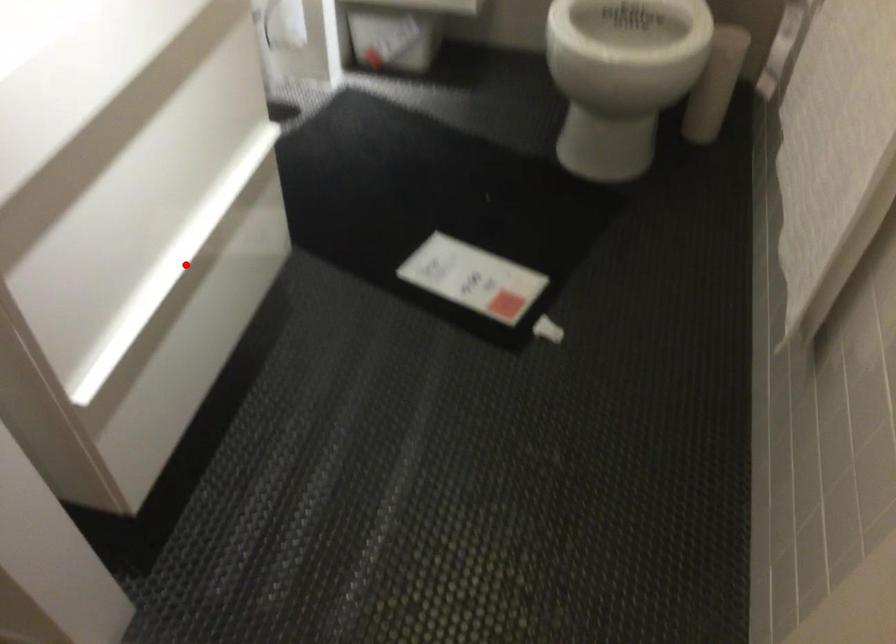
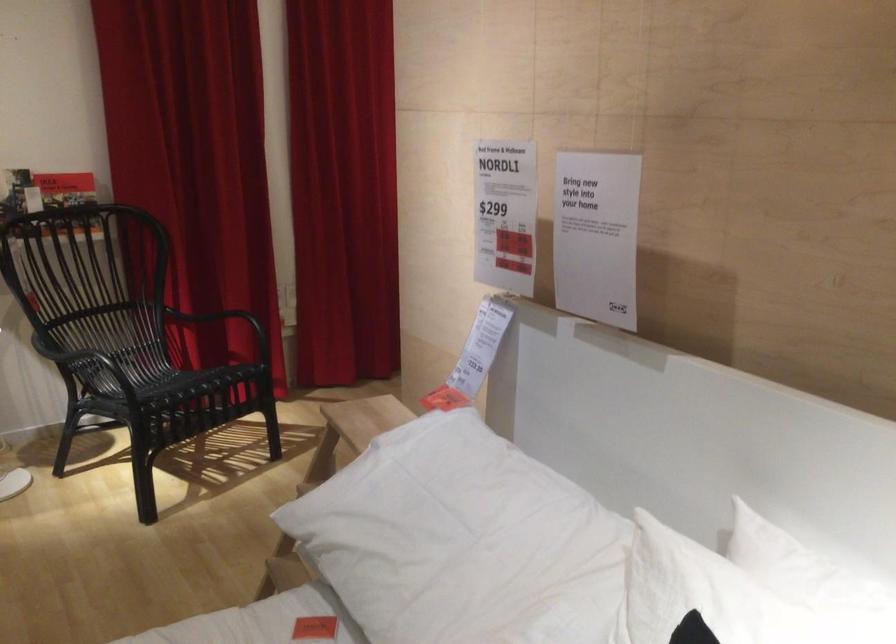
Question: I am providing you with two images of the same scene from different viewpoints. A red point is marked on the first image. Is the red point's position out of view in image 2?

Choices:
 (A) Yes
 (B) No

Answer: (A)